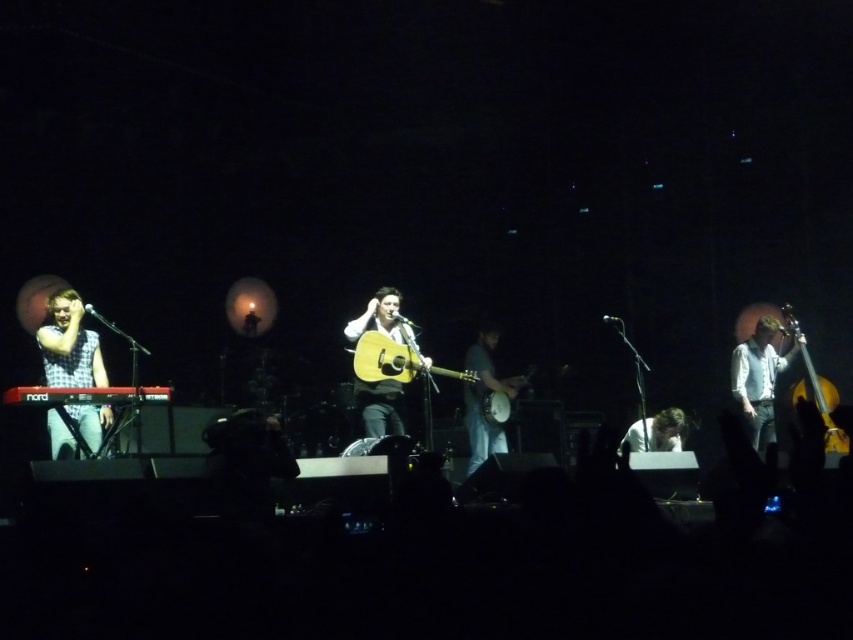
Is shiny silver bass at right to the left of wooden acoustic guitar at center from the viewer's perspective?

In fact, shiny silver bass at right is to the right of wooden acoustic guitar at center.

At what (x,y) coordinates should I click in order to perform the action: click on shiny silver bass at right. Please return your answer as a coordinate pair (x, y). Looking at the image, I should click on (759, 378).

Between point (740, 358) and point (502, 408), which one is positioned behind?

The point (502, 408) is behind.

Identify the location of shiny silver bass at right. (759, 378).

Who is lower down, blue denim jeans at center or shiny gold guitar at right?

Positioned lower is blue denim jeans at center.

Between point (474, 417) and point (792, 396), which one is positioned in front?

Point (792, 396) is in front.

Identify the location of blue denim jeans at center. pyautogui.click(x=483, y=396).

Is acoustic guitar at center taller than shiny gold guitar at right?

Incorrect, acoustic guitar at center's height is not larger of shiny gold guitar at right's.

Is acoustic guitar at center behind shiny gold guitar at right?

No.

The height and width of the screenshot is (640, 853). What are the coordinates of `acoustic guitar at center` in the screenshot? It's located at (380, 406).